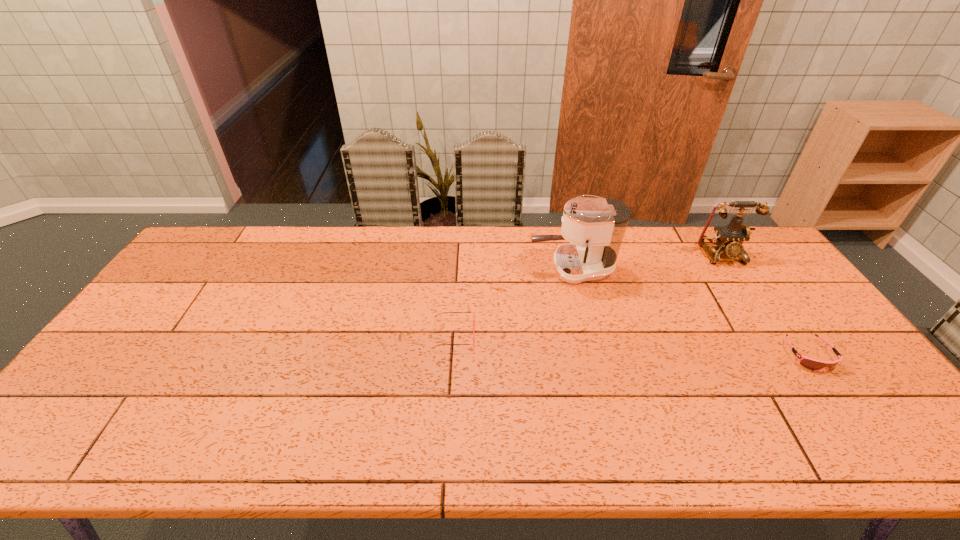
Locate an element on the screen. The height and width of the screenshot is (540, 960). vacant space situated 0.060m on the front-facing side of the goggles is located at coordinates (837, 393).

Where is `coffee maker at the far edge`? The height and width of the screenshot is (540, 960). coffee maker at the far edge is located at coordinates (595, 227).

The width and height of the screenshot is (960, 540). In order to click on telephone that is at the far edge in this screenshot , I will do `click(729, 239)`.

Locate an element on the screen. The height and width of the screenshot is (540, 960). telephone that is at the right edge is located at coordinates (729, 239).

The width and height of the screenshot is (960, 540). Find the location of `goggles positioned at the right edge`. goggles positioned at the right edge is located at coordinates (809, 363).

Image resolution: width=960 pixels, height=540 pixels. Find the location of `object that is at the far right corner`. object that is at the far right corner is located at coordinates tap(729, 239).

Locate an element on the screen. The image size is (960, 540). vacant space at the far edge of the desktop is located at coordinates (319, 238).

In order to click on free location at the near edge of the desktop in this screenshot , I will do `click(625, 457)`.

You are a GUI agent. You are given a task and a screenshot of the screen. Output one action in this format:
    pyautogui.click(x=<x>, y=<y>)
    Task: Click on the vacant space at the left edge
    The width and height of the screenshot is (960, 540).
    Given the screenshot: What is the action you would take?
    pyautogui.click(x=180, y=301)

What are the coordinates of `vacant space at the right edge` in the screenshot? It's located at (789, 285).